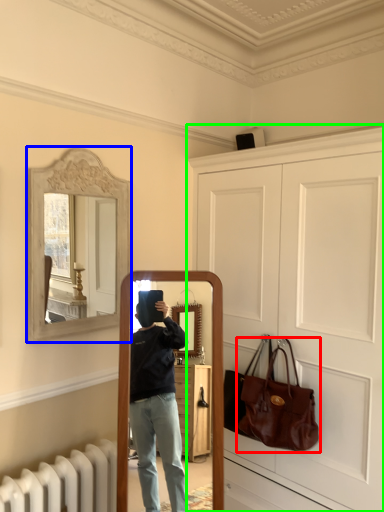
Question: Which object is positioned closest to handbag (highlighted by a red box)? Select from picture frame (highlighted by a blue box) and door (highlighted by a green box).

Choices:
 (A) picture frame
 (B) door

Answer: (B)